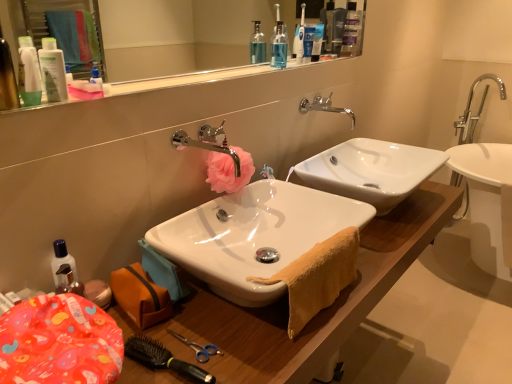
Identify the location of vacant point to the right of black rubber brush at lower left, which is the first brush in front-to-back order. pyautogui.click(x=252, y=350).